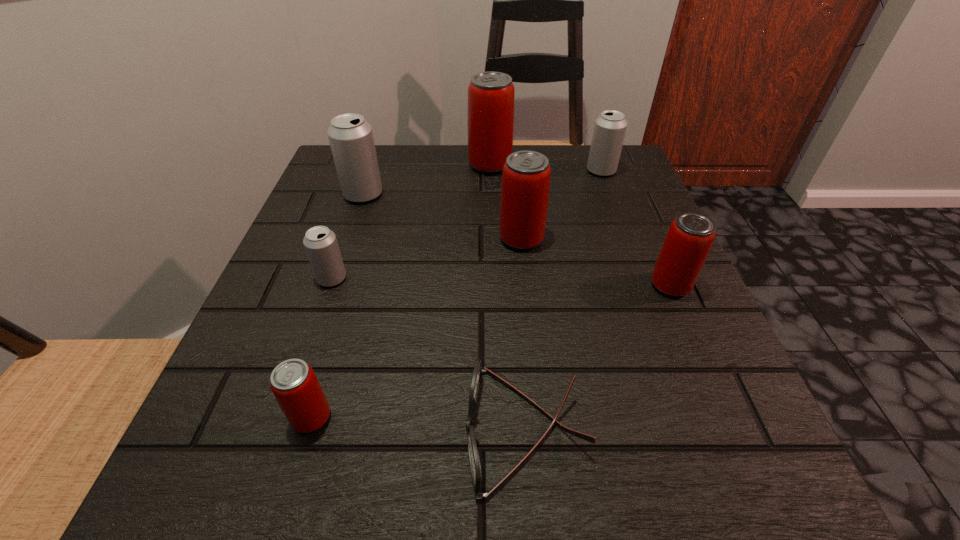
You are a GUI agent. You are given a task and a screenshot of the screen. Output one action in this format:
    pyautogui.click(x=<x>, y=<y>)
    Task: Click on the vacant space at the right edge
    
    Given the screenshot: What is the action you would take?
    pyautogui.click(x=719, y=346)

In the image, there is a desktop. Where is `vacant space at the far right corner`? The height and width of the screenshot is (540, 960). vacant space at the far right corner is located at coordinates (621, 181).

I want to click on vacant space that's between the shortest object and the smallest pink beer can, so click(419, 423).

At what (x,y) coordinates should I click in order to perform the action: click on free spot between the second biggest pink beer can and the fifth nearest beer can. Please return your answer as a coordinate pair (x, y). Looking at the image, I should click on (443, 217).

Find the location of `free space between the spectacles and the second farthest white beer can`. free space between the spectacles and the second farthest white beer can is located at coordinates (444, 312).

Where is `vacant point located between the second smallest white beer can and the spectacles`? This screenshot has width=960, height=540. vacant point located between the second smallest white beer can and the spectacles is located at coordinates (564, 300).

At what (x,y) coordinates should I click in order to perform the action: click on vacant area that lies between the biggest white beer can and the nearest white beer can. Please return your answer as a coordinate pair (x, y). This screenshot has width=960, height=540. Looking at the image, I should click on (348, 237).

Find the location of a particular element. Image resolution: width=960 pixels, height=540 pixels. free space between the spectacles and the second biggest white beer can is located at coordinates (564, 300).

The width and height of the screenshot is (960, 540). In order to click on free point between the second farthest white beer can and the leftmost pink beer can in this screenshot , I will do `click(337, 306)`.

Locate an element on the screen. This screenshot has height=540, width=960. vacant area that lies between the nearest white beer can and the shortest object is located at coordinates (428, 354).